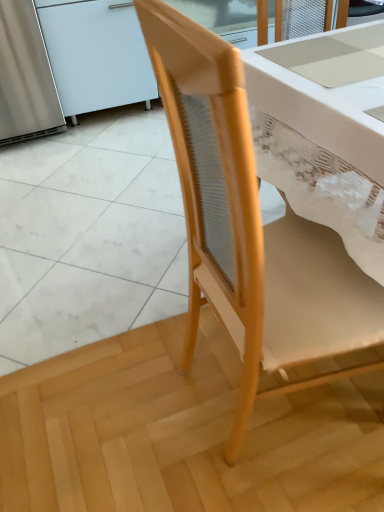
The width and height of the screenshot is (384, 512). Find the location of `vacant space underneath natural wood chair at center (from a real-world perspective)`. vacant space underneath natural wood chair at center (from a real-world perspective) is located at coordinates click(x=251, y=406).